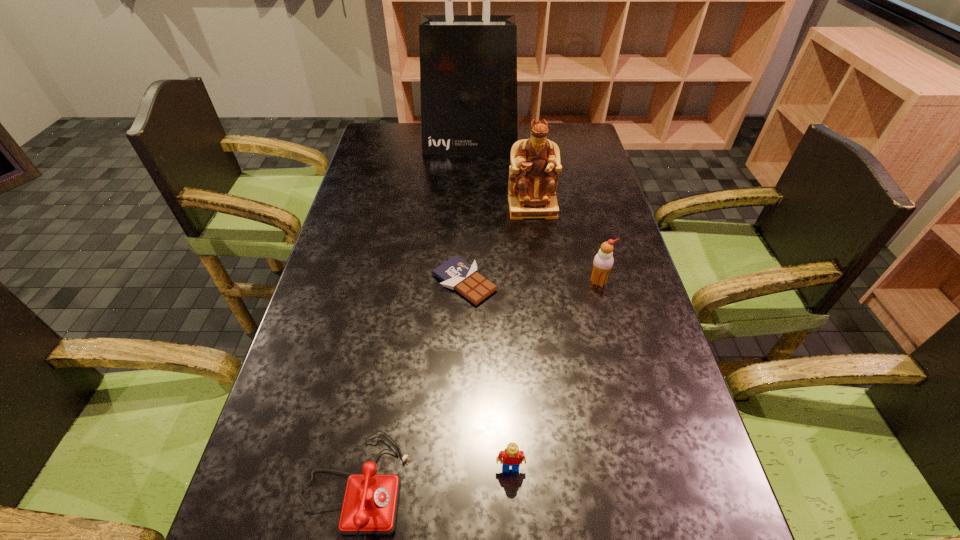
Where is `the tallest object`? This screenshot has width=960, height=540. the tallest object is located at coordinates (468, 63).

Find the location of a particular element. This screenshot has height=540, width=960. shopping bag is located at coordinates (468, 63).

What are the coordinates of `the second tallest object` in the screenshot? It's located at (535, 165).

Identify the location of the fifth nearest object. The image size is (960, 540). (535, 165).

Image resolution: width=960 pixels, height=540 pixels. Identify the location of icecream. (603, 261).

Find the location of a particular element. The width and height of the screenshot is (960, 540). the third tallest object is located at coordinates (603, 261).

I want to click on Lego, so click(511, 456).

I want to click on chocolate bar, so click(455, 273).

Find the location of `vacant space situated on the front with handles of the farthest object`. vacant space situated on the front with handles of the farthest object is located at coordinates (468, 222).

You are a GUI agent. You are given a task and a screenshot of the screen. Output one action in this format:
    pyautogui.click(x=<x>, y=<y>)
    Task: Click on the free space located on the front-facing side of the second farthest object
    This screenshot has height=540, width=960.
    Given the screenshot: What is the action you would take?
    pyautogui.click(x=545, y=301)